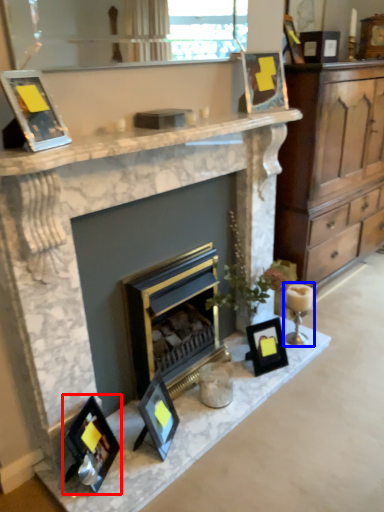
Question: Among these objects, which one is nearest to the camera, picture frame (highlighted by a red box) or candle holder (highlighted by a blue box)?

Choices:
 (A) picture frame
 (B) candle holder

Answer: (A)